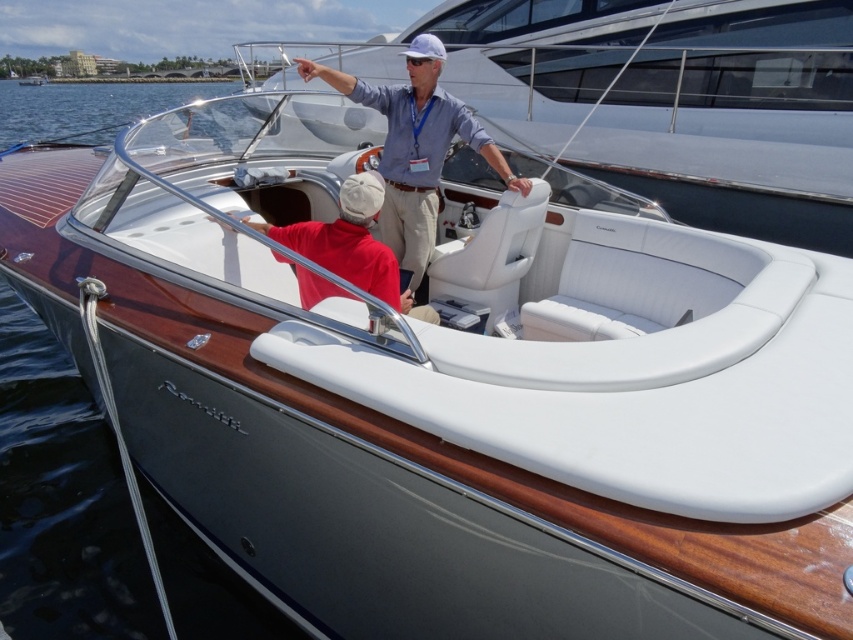
Question: Does white leather boat at center appear on the left side of matte blue shirt at center?

Choices:
 (A) yes
 (B) no

Answer: (B)

Question: Among these points, which one is nearest to the camera?

Choices:
 (A) (407, 61)
 (B) (380, 65)
 (C) (357, 221)

Answer: (C)

Question: Can you confirm if white leather boat at center is bigger than matte blue shirt at center?

Choices:
 (A) no
 (B) yes

Answer: (A)

Question: Is matte blue shirt at center in front of red matte shirt at center?

Choices:
 (A) yes
 (B) no

Answer: (B)

Question: Which of these objects is positioned closest to the white leather boat at center?

Choices:
 (A) matte blue shirt at center
 (B) red matte shirt at center

Answer: (A)

Question: Which of these objects is positioned closest to the white leather boat at center?

Choices:
 (A) red matte shirt at center
 (B) matte blue shirt at center

Answer: (B)